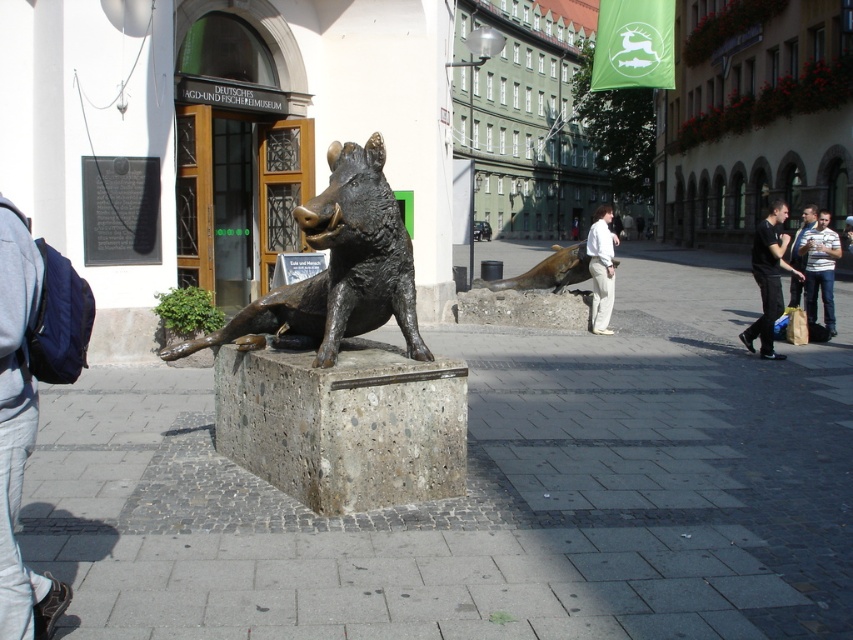
You are standing at the entrance of the German Hunting and Fishing Museum and want to locate the bronze statue of the wild boar. According to the map, the statue is marked by the point at coordinates (338, 268). Can you confirm if this point corresponds to the bronze statue at the center of the image?

Yes, the bronze statue at center is represented by point (338, 268), so the coordinates on the map do correspond to the bronze statue at the center of the image.

Consider the image. You are a visitor standing in front of the bronze statue at center and the white shirt at center. Which object is positioned higher from the ground?

The bronze statue at center is located above the white shirt at center, so it is positioned higher from the ground.